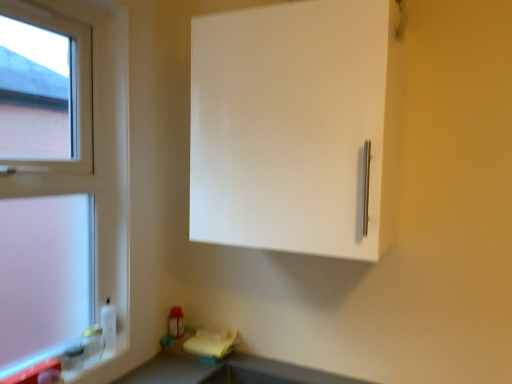
What do you see at coordinates (227, 372) in the screenshot?
I see `smooth gray countertop at lower center` at bounding box center [227, 372].

Measure the distance between point (x=278, y=6) and camera.

Point (x=278, y=6) and camera are 1.20 meters apart from each other.

Locate an element on the screen. The image size is (512, 384). smooth gray countertop at lower center is located at coordinates (227, 372).

Between point (97, 16) and point (311, 378), which one is positioned in front?

The point (97, 16) is closer to the camera.

Based on the photo, does white plastic window at left have a lesser width compared to smooth gray countertop at lower center?

Yes.

Considering the positions of objects white plastic window at left and smooth gray countertop at lower center in the image provided, who is behind, white plastic window at left or smooth gray countertop at lower center?

white plastic window at left.

Is white plastic window at left aimed at smooth gray countertop at lower center?

Yes, white plastic window at left faces towards smooth gray countertop at lower center.

From a real-world perspective, is smooth gray countertop at lower center above or below white matte cabinet at upper right?

smooth gray countertop at lower center is situated lower than white matte cabinet at upper right in the real world.

Is the depth of smooth gray countertop at lower center greater than that of white matte cabinet at upper right?

No, it is not.

Based on the photo, can you confirm if smooth gray countertop at lower center is taller than white matte cabinet at upper right?

No, smooth gray countertop at lower center is not taller than white matte cabinet at upper right.

From the image's perspective, is smooth gray countertop at lower center located above or below white matte cabinet at upper right?

From the image's perspective, smooth gray countertop at lower center appears below white matte cabinet at upper right.

Is smooth gray countertop at lower center at the back of white matte cabinet at upper right?

white matte cabinet at upper right is not turned away from smooth gray countertop at lower center.

Which is less distant, (353, 127) or (243, 354)?

Clearly, point (353, 127) is closer to the camera than point (243, 354).

In the scene shown: Considering the sizes of white matte cabinet at upper right and smooth gray countertop at lower center in the image, is white matte cabinet at upper right taller or shorter than smooth gray countertop at lower center?

Considering their sizes, white matte cabinet at upper right has more height than smooth gray countertop at lower center.

Looking at this image, is white matte cabinet at upper right beside smooth gray countertop at lower center?

white matte cabinet at upper right is not next to smooth gray countertop at lower center, and they're not touching.

From the image's perspective, is white matte cabinet at upper right on white plastic window at left?

Indeed, from the image's perspective, white matte cabinet at upper right is shown above white plastic window at left.

Considering the positions of objects white matte cabinet at upper right and white plastic window at left in the image provided, who is more to the right, white matte cabinet at upper right or white plastic window at left?

Positioned to the right is white matte cabinet at upper right.

Between white matte cabinet at upper right and white plastic window at left, which one has less height?

Standing shorter between the two is white matte cabinet at upper right.

Between point (395, 207) and point (127, 79), which one is positioned behind?

The point (127, 79) is more distant.

Which of these two, smooth gray countertop at lower center or white plastic window at left, stands taller?

white plastic window at left.

Is smooth gray countertop at lower center not close to white plastic window at left?

No, smooth gray countertop at lower center is not far away from white plastic window at left.

From a real-world perspective, who is located lower, smooth gray countertop at lower center or white plastic window at left?

smooth gray countertop at lower center.

From a real-world perspective, which is physically above, white plastic window at left or white matte cabinet at upper right?

white matte cabinet at upper right.

Considering the positions of objects white plastic window at left and white matte cabinet at upper right in the image provided, who is behind, white plastic window at left or white matte cabinet at upper right?

white plastic window at left is behind.

Considering the positions of points (63, 9) and (312, 64), is point (63, 9) closer to camera compared to point (312, 64)?

No, it is behind (312, 64).

Locate an element on the screen. counter top below the white plastic window at left (from a real-world perspective) is located at coordinates (227, 372).

Locate an element on the screen. cabinetry behind the smooth gray countertop at lower center is located at coordinates (295, 127).

Considering their positions, is white plastic window at left positioned further to white matte cabinet at upper right than smooth gray countertop at lower center?

Among the two, smooth gray countertop at lower center is located further to white matte cabinet at upper right.

Looking at the image, which one is located closer to white plastic window at left, smooth gray countertop at lower center or white matte cabinet at upper right?

Among the two, white matte cabinet at upper right is located nearer to white plastic window at left.

When comparing their distances from smooth gray countertop at lower center, does white matte cabinet at upper right or white plastic window at left seem closer?

Based on the image, white plastic window at left appears to be nearer to smooth gray countertop at lower center.

Based on their spatial positions, is smooth gray countertop at lower center or white plastic window at left closer to white matte cabinet at upper right?

The object closer to white matte cabinet at upper right is white plastic window at left.

Looking at the image, which one is located further to white plastic window at left, white matte cabinet at upper right or smooth gray countertop at lower center?

smooth gray countertop at lower center is positioned further to the anchor white plastic window at left.

Looking at the image, which one is located closer to smooth gray countertop at lower center, white plastic window at left or white matte cabinet at upper right?

white plastic window at left.

This screenshot has width=512, height=384. I want to click on window between white matte cabinet at upper right and smooth gray countertop at lower center vertically, so click(x=95, y=147).